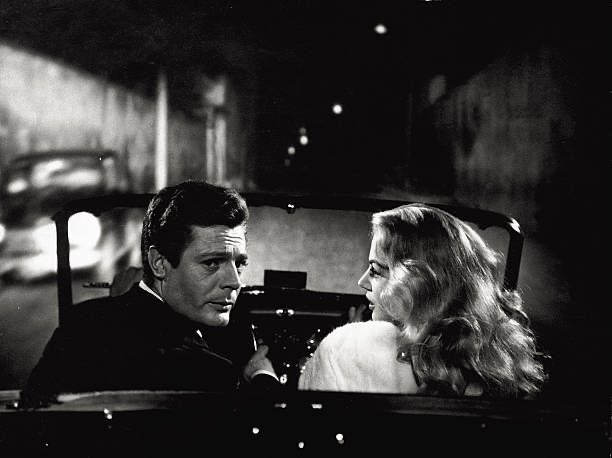
Find the location of a particular element. The height and width of the screenshot is (458, 612). window is located at coordinates (117, 183), (69, 173), (305, 246).